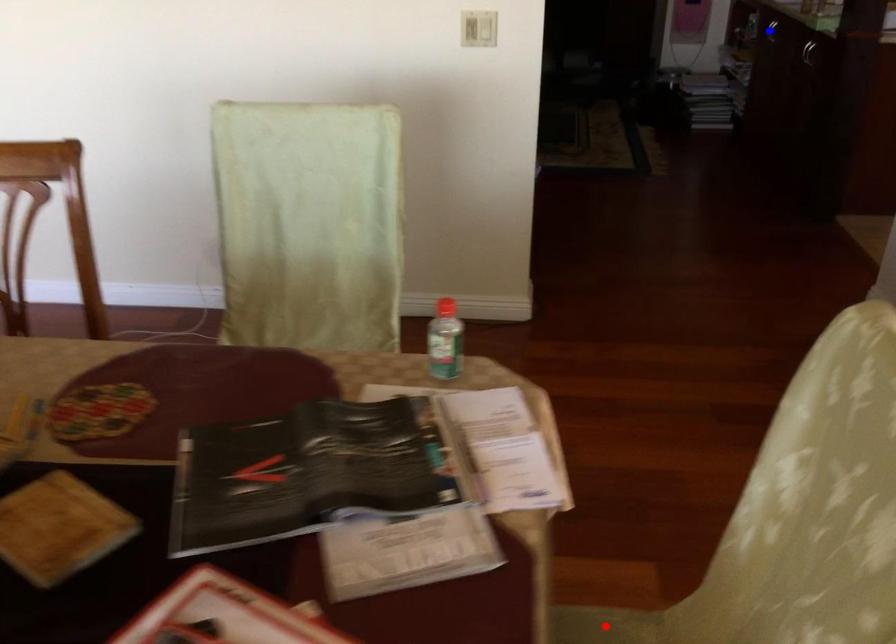
Question: Two points are marked on the image. Which point is closer to the camera?

Choices:
 (A) Blue point is closer.
 (B) Red point is closer.

Answer: (B)